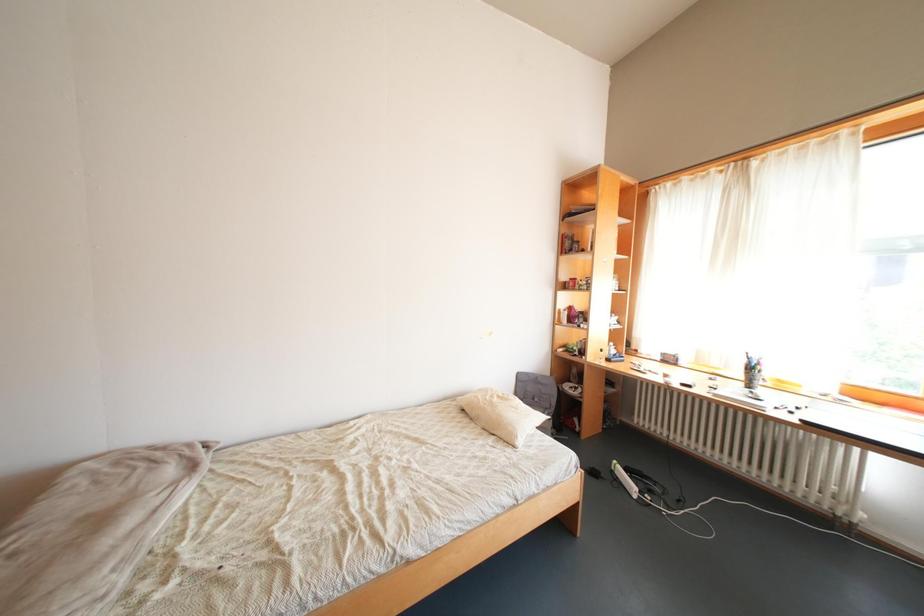
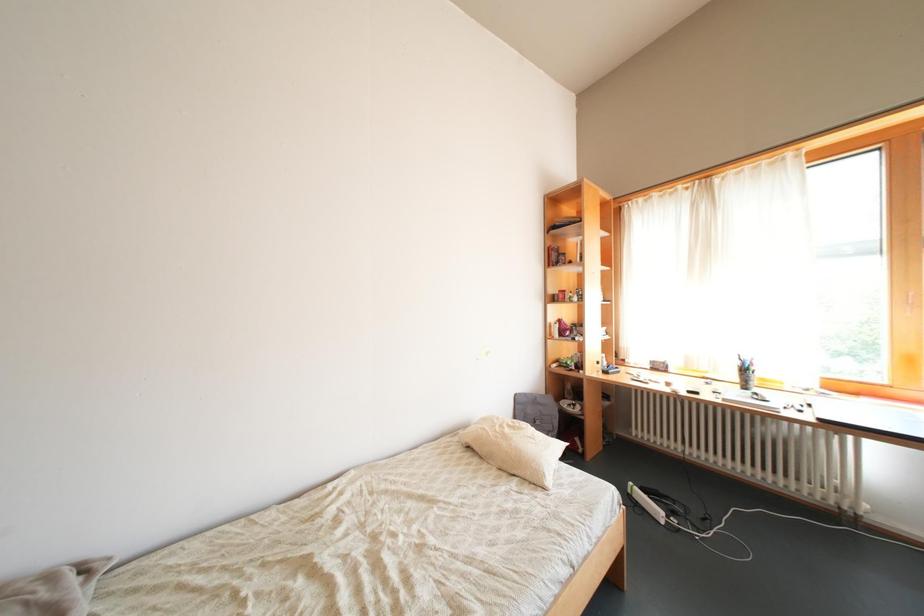
In a continuous first-person perspective shot, in which direction is the camera moving?

The cameraman walked toward left, forward.